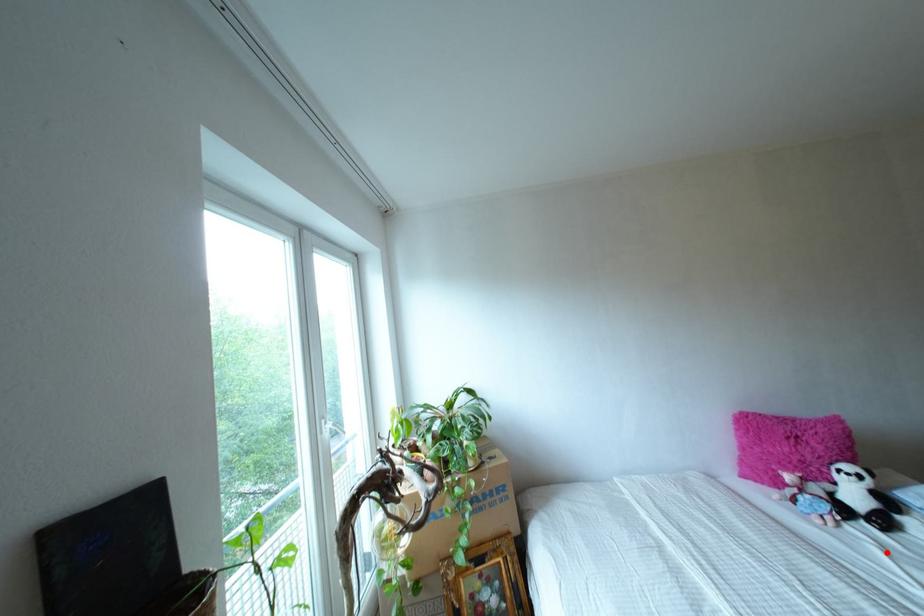
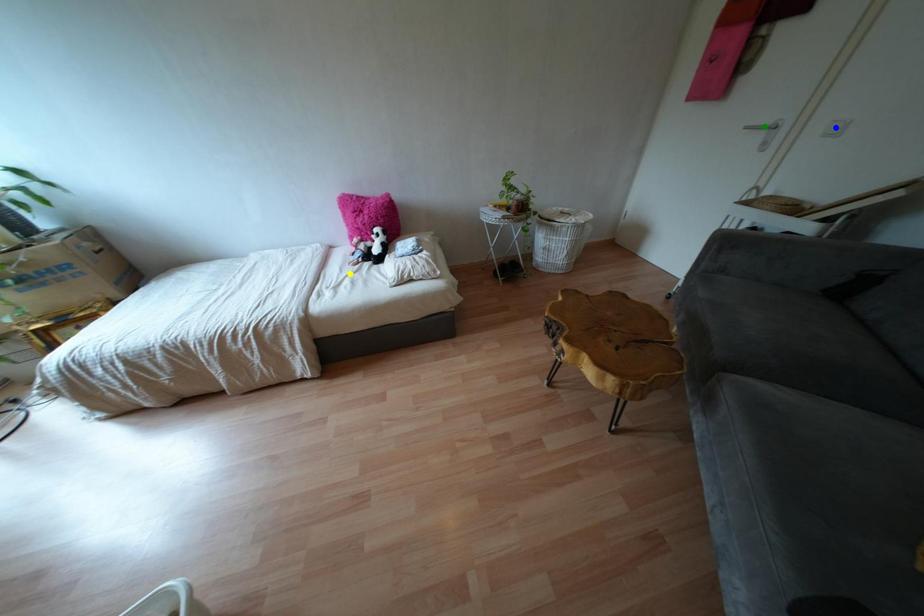
Question: I am providing you with two images of the same scene from different viewpoints. A red point is marked on the first image. You are given multiple points on the second image. Which point in image 2 is actually the same real-world point as the red point in image 1?

Choices:
 (A) yellow point
 (B) green point
 (C) blue point

Answer: (A)